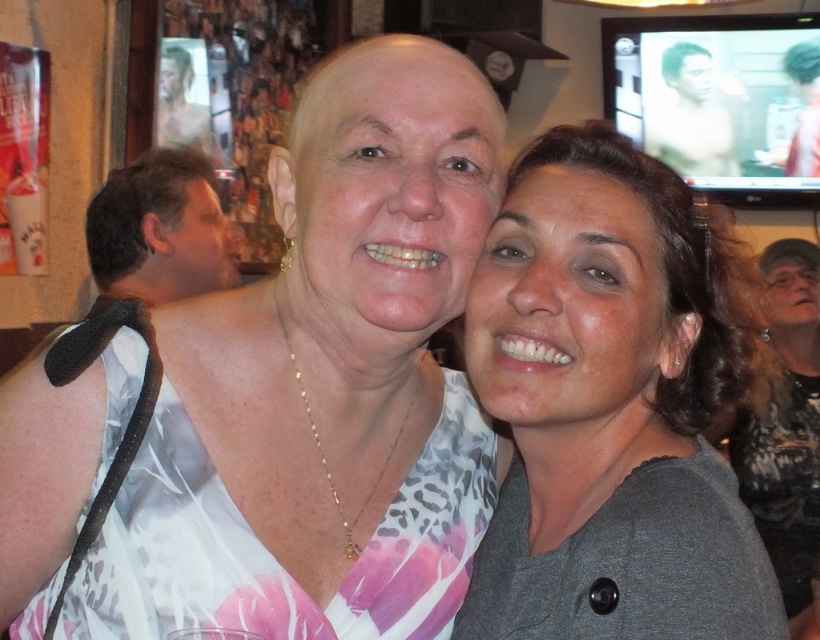
You are a photographer trying to adjust the lighting for a portrait. You notice the dark brown hair at right and the shiny skin man at upper right. Which of these two is positioned more to the right side of the image?

The shiny skin man at upper right is positioned more to the right side of the image because the dark brown hair at right is to its left.

You are a photographer trying to capture a clear shot of both the gray matte shirt at center and the shiny silver hair at upper center. Which object should you focus on first to ensure it appears sharp in the photo?

The gray matte shirt at center is larger in size than the shiny silver hair at upper center, so focusing on the gray matte shirt at center first will ensure it appears sharp, and the shiny silver hair at upper center should also be in focus due to its proximity in depth of field.

In the scene shown: You are a photographer trying to focus on the dark brown hair at right and the shiny silver hair at upper center. Which hair is nearer to you?

The dark brown hair at right is closer to the viewer than the shiny silver hair at upper center.